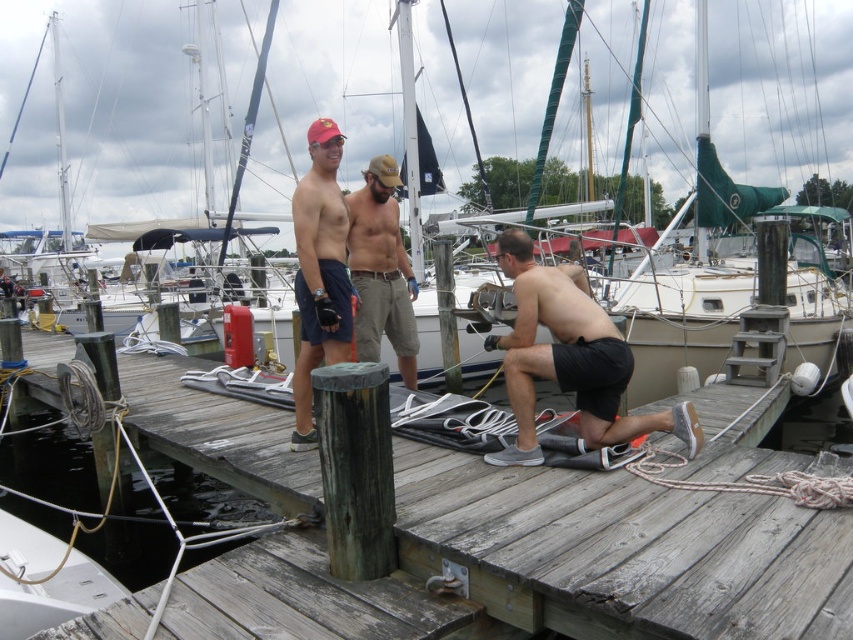
Between point (659, 28) and point (395, 320), which one is positioned in front?

Point (395, 320)

Who is more distant from viewer, [508,90] or [355,349]?

The point [508,90] is behind.

The height and width of the screenshot is (640, 853). What are the coordinates of `white matte sailboat at center` in the screenshot? It's located at (115, 100).

Does white matte sailboat at center have a greater width compared to weathered wood dock at center?

Yes, white matte sailboat at center is wider than weathered wood dock at center.

Between white matte sailboat at center and weathered wood dock at center, which one is positioned higher?

white matte sailboat at center is above.

Find the location of a particular element. The width and height of the screenshot is (853, 640). white matte sailboat at center is located at coordinates (115, 100).

Consider the image. Is white matte sailboat at center to the left of black matte shorts at center from the viewer's perspective?

Yes, white matte sailboat at center is to the left of black matte shorts at center.

Is the position of white matte sailboat at center less distant than that of black matte shorts at center?

No.

Who is more forward, (105, 154) or (601, 344)?

Point (601, 344)

This screenshot has width=853, height=640. I want to click on white matte sailboat at center, so click(115, 100).